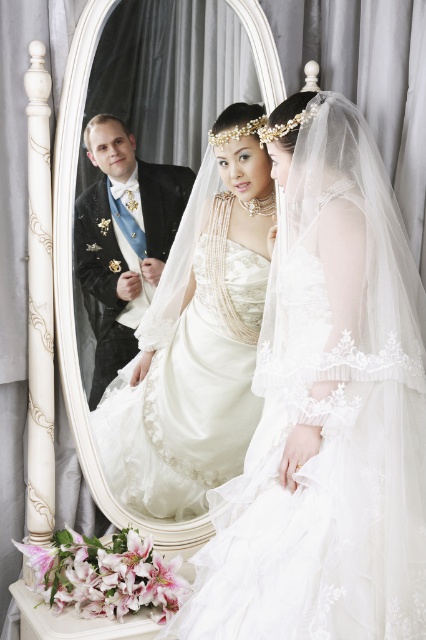
Who is positioned more to the right, white lace dress at center or satin dress at center?

white lace dress at center is more to the right.

What do you see at coordinates (327, 448) in the screenshot? The height and width of the screenshot is (640, 426). I see `white lace dress at center` at bounding box center [327, 448].

Who is more forward, (195,586) or (135,378)?

Point (195,586) is in front.

Where is `white lace dress at center`? This screenshot has width=426, height=640. white lace dress at center is located at coordinates (327, 448).

Is white lace dress at center bigger than black satin tuxedo at left?

Yes, white lace dress at center is bigger than black satin tuxedo at left.

Which is in front, point (357, 394) or point (140, 237)?

Point (357, 394)

Where is `white lace dress at center`? This screenshot has height=640, width=426. white lace dress at center is located at coordinates (327, 448).

Measure the distance between satin dress at center and black satin tuxedo at left.

satin dress at center and black satin tuxedo at left are 6.88 inches apart from each other.

Does satin dress at center appear under black satin tuxedo at left?

Yes.

Does point (134, 452) come behind point (89, 132)?

Yes, point (134, 452) is behind point (89, 132).

At what (x,y) coordinates should I click in order to perform the action: click on satin dress at center. Please return your answer as a coordinate pair (x, y). Image resolution: width=426 pixels, height=640 pixels. Looking at the image, I should click on (196, 339).